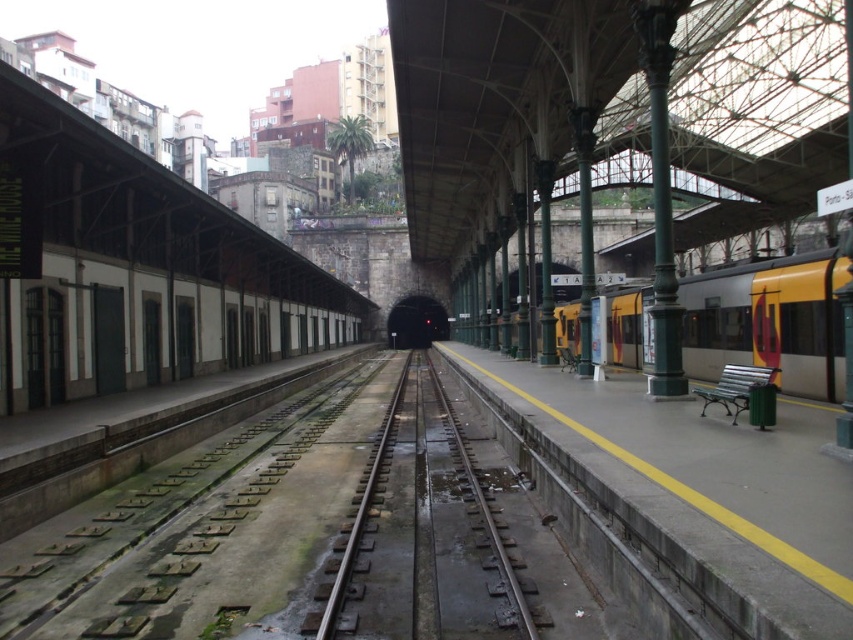
You are standing at point A located at coordinates (685,490) on the train station platform. What object is exactly at your current location?

The point at coordinates (685,490) is exactly where the concrete platform at center is located.